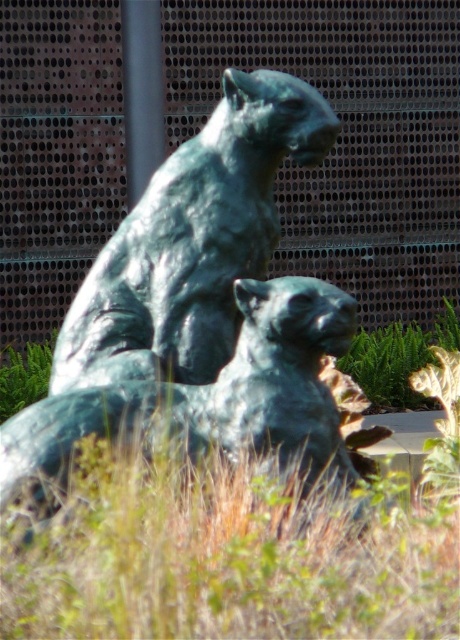
Question: Which is farther from the metallic pole at upper center?

Choices:
 (A) green patina statue at center
 (B) green grass at lower center

Answer: (B)

Question: Considering the relative positions of green patina statue at center and green grass at lower center in the image provided, where is green patina statue at center located with respect to green grass at lower center?

Choices:
 (A) below
 (B) above

Answer: (B)

Question: Which point is farther to the camera?

Choices:
 (A) metallic pole at upper center
 (B) green patina statue at center
 (C) green grass at lower center

Answer: (A)

Question: Which of the following is the closest to the observer?

Choices:
 (A) metallic pole at upper center
 (B) green patina statue at center

Answer: (B)

Question: Can you confirm if green patina statue at center is smaller than green grass at lower center?

Choices:
 (A) yes
 (B) no

Answer: (B)

Question: Is green patina statue at center wider than green grass at lower center?

Choices:
 (A) no
 (B) yes

Answer: (A)